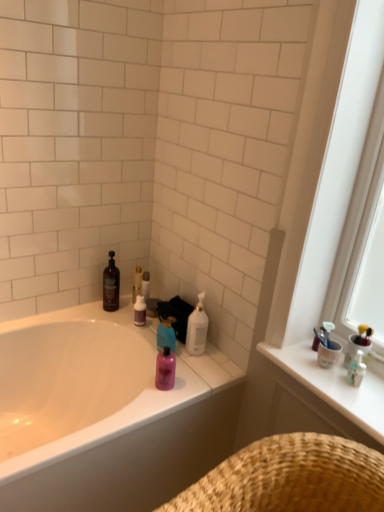
This screenshot has height=512, width=384. Find the location of `vacant space behind pink glossy bottle at center, the second toiletry viewed from the back`. vacant space behind pink glossy bottle at center, the second toiletry viewed from the back is located at coordinates (181, 362).